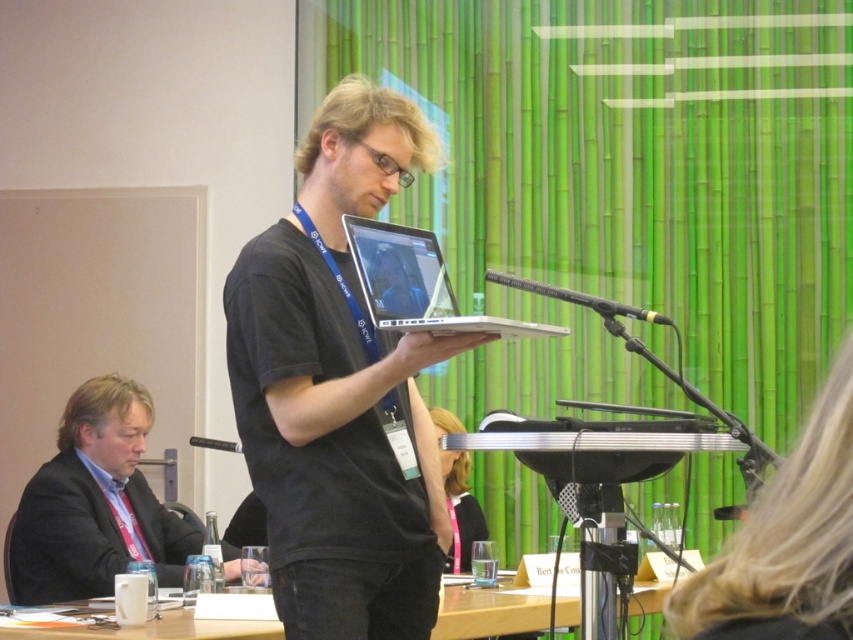
Looking at this image, you are attending a conference and notice two items in the scene. The first is the blonde hair at upper right, and the second is the wooden table at lower center. Which of these two items is taller?

The blonde hair at upper right is taller than the wooden table at lower center.

You are a photographer in the conference room. You need to take a photo of the black matte laptop at center without the blonde hair at upper right appearing in the frame. Is this possible?

The blonde hair at upper right is behind the black matte laptop at center, so you can position the camera so that the laptop blocks the view of the hair, making it possible to take a photo of the black matte laptop at center without the blonde hair at upper right in the frame.

You are attending a conference and need to place a small note on the table in front of the presenter. The note must be placed closer to you than to the edge of the table. Which of the two points, point (813, 426) or point (457, 632), should you choose?

You should choose point (813, 426) because it is closer to the viewer than point (457, 632), so placing the note there would satisfy the requirement of being closer to you than the edge.